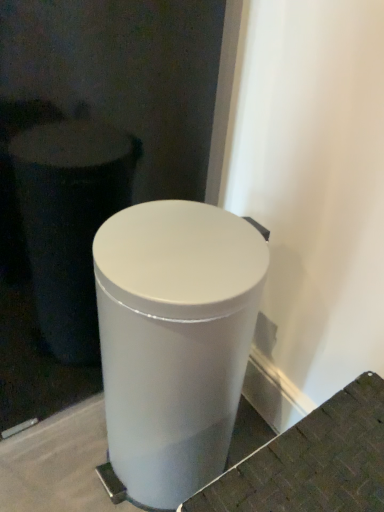
What do you see at coordinates (312, 461) in the screenshot?
I see `white matte trash can at center` at bounding box center [312, 461].

At what (x,y) coordinates should I click in order to perform the action: click on white matte trash can at center. Please return your answer as a coordinate pair (x, y). The width and height of the screenshot is (384, 512). Looking at the image, I should click on (312, 461).

Describe the element at coordinates (174, 340) in the screenshot. This screenshot has height=512, width=384. I see `white glossy trash can at center` at that location.

Image resolution: width=384 pixels, height=512 pixels. Find the location of `white glossy trash can at center`. white glossy trash can at center is located at coordinates (174, 340).

This screenshot has height=512, width=384. In order to click on white matte trash can at center in this screenshot , I will do `click(312, 461)`.

Is white glossy trash can at center to the left or to the right of white matte trash can at center in the image?

white glossy trash can at center is positioned on white matte trash can at center's left side.

Is the depth of white glossy trash can at center greater than that of white matte trash can at center?

That is True.

Is point (201, 279) closer to viewer compared to point (294, 505)?

No, it is behind (294, 505).

From the image's perspective, relative to white matte trash can at center, is white glossy trash can at center above or below?

white glossy trash can at center is above white matte trash can at center.

From a real-world perspective, relative to white matte trash can at center, is white glossy trash can at center vertically above or below?

white glossy trash can at center is above white matte trash can at center.

Does white glossy trash can at center have a greater width compared to white matte trash can at center?

No.

Between white glossy trash can at center and white matte trash can at center, which one has less height?

white matte trash can at center.

Looking at this image, considering the sizes of objects white glossy trash can at center and white matte trash can at center in the image provided, who is bigger, white glossy trash can at center or white matte trash can at center?

white glossy trash can at center.

Which is correct: white glossy trash can at center is inside white matte trash can at center, or outside of it?

white glossy trash can at center is not inside white matte trash can at center, it's outside.

Are white glossy trash can at center and white matte trash can at center far apart?

white glossy trash can at center is near white matte trash can at center, not far away.

Is white glossy trash can at center oriented towards white matte trash can at center?

No, white glossy trash can at center is not facing towards white matte trash can at center.

What's the angular difference between white glossy trash can at center and white matte trash can at center's facing directions?

There is a 0.00239-degree angle between the facing directions of white glossy trash can at center and white matte trash can at center.

Identify the location of waste container above the white matte trash can at center (from the image's perspective). (174, 340).

Considering the positions of objects white matte trash can at center and white glossy trash can at center in the image provided, who is more to the left, white matte trash can at center or white glossy trash can at center?

From the viewer's perspective, white glossy trash can at center appears more on the left side.

Which object is closer to the camera, white matte trash can at center or white glossy trash can at center?

white matte trash can at center is in front.

Which is behind, point (269, 483) or point (122, 242)?

The point (122, 242) is farther.

From the image's perspective, which object appears higher, white matte trash can at center or white glossy trash can at center?

white glossy trash can at center.

From a real-world perspective, is white matte trash can at center on white glossy trash can at center?

No, from a real-world perspective, white matte trash can at center is not on top of white glossy trash can at center.

Is white matte trash can at center thinner than white glossy trash can at center?

No, white matte trash can at center is not thinner than white glossy trash can at center.

Does white matte trash can at center have a lesser height compared to white glossy trash can at center?

Indeed, white matte trash can at center has a lesser height compared to white glossy trash can at center.

Considering the sizes of white matte trash can at center and white glossy trash can at center in the image, is white matte trash can at center bigger or smaller than white glossy trash can at center?

Clearly, white matte trash can at center is smaller in size than white glossy trash can at center.

Looking at this image, is white matte trash can at center surrounding white glossy trash can at center?

No, white matte trash can at center does not contain white glossy trash can at center.

Are white matte trash can at center and white glossy trash can at center beside each other?

No, white matte trash can at center is not beside white glossy trash can at center.

Is white matte trash can at center turned away from white glossy trash can at center?

No, white matte trash can at center is not facing away from white glossy trash can at center.

How different are the orientations of white matte trash can at center and white glossy trash can at center in degrees?

0.00239 degrees.

Where is `waste container that is above the white matte trash can at center (from the image's perspective)`? waste container that is above the white matte trash can at center (from the image's perspective) is located at coordinates (174, 340).

Locate an element on the screen. The width and height of the screenshot is (384, 512). concrete below the white glossy trash can at center (from the image's perspective) is located at coordinates (312, 461).

This screenshot has width=384, height=512. In order to click on waste container behind the white matte trash can at center in this screenshot , I will do `click(174, 340)`.